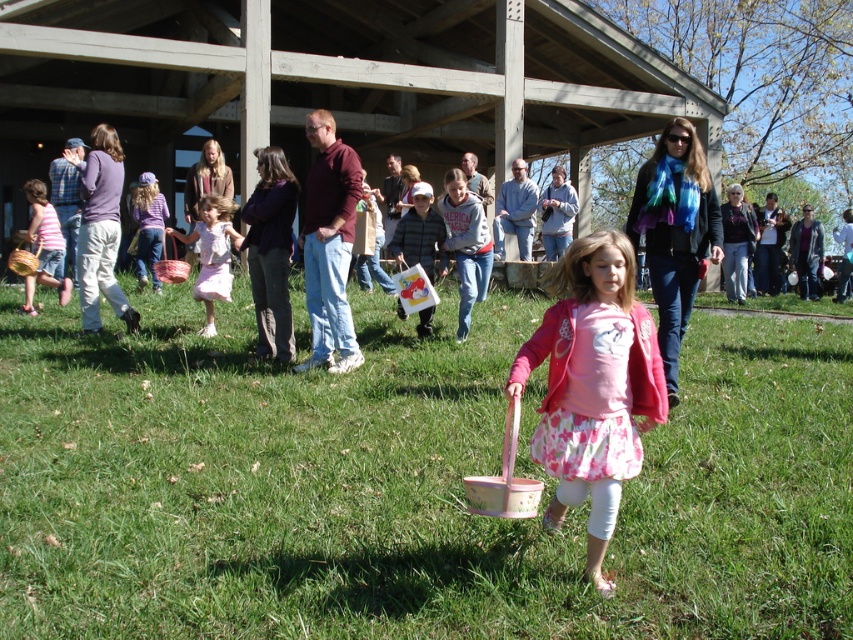
You are planning to place a small picnic blanket on the green grass at center. Considering the space occupied by the matte pink dress at left, will there be enough room for the blanket?

The green grass at center might be wider than matte pink dress at left, so there is likely enough space to place the picnic blanket there.

You are a photographer at the event and want to capture both the pink floral skirt at center and the matte pink dress at left in the same frame. Based on their positions, which direction should you move your camera to include both?

The pink floral skirt at center is to the right of the matte pink dress at left. To include both in the frame, move your camera to the left to capture the matte pink dress at left and then pan towards the right to include the pink floral skirt at center.

You are organizing a game where players must run from the matte pink dress at left to the pink fabric dress at center. What is the minimum distance players need to cover?

The minimum distance players need to cover is 3.14 meters between the matte pink dress at left and the pink fabric dress at center.